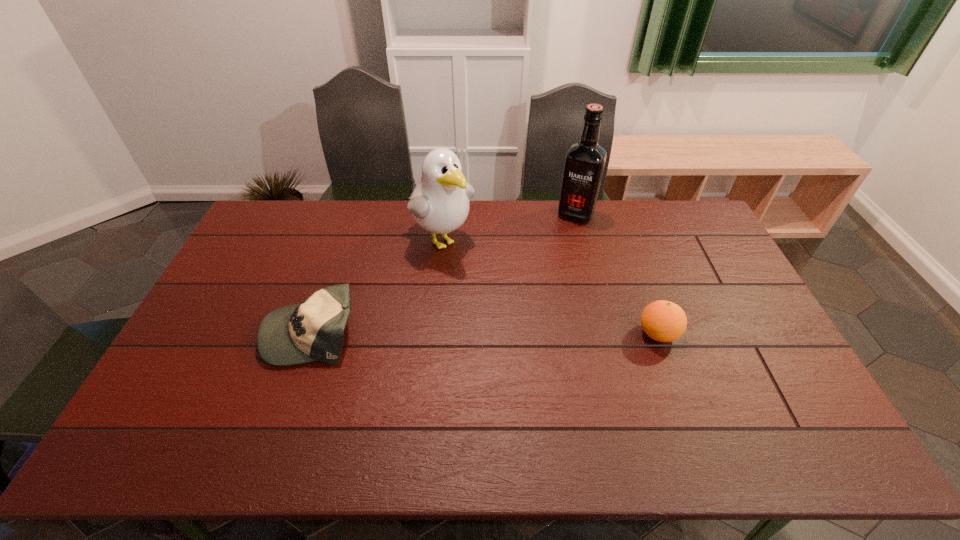
Locate an element on the screen. vacant space at the right edge is located at coordinates (740, 300).

The height and width of the screenshot is (540, 960). In the image, there is a desktop. Find the location of `vacant space at the far left corner`. vacant space at the far left corner is located at coordinates (265, 207).

Identify the location of free space between the liquor and the baseball cap. The image size is (960, 540). (444, 273).

At what (x,y) coordinates should I click in order to perform the action: click on unoccupied area between the third object from right to left and the liquor. Please return your answer as a coordinate pair (x, y). The height and width of the screenshot is (540, 960). Looking at the image, I should click on (509, 226).

The width and height of the screenshot is (960, 540). What are the coordinates of `free space between the orange and the leftmost object` in the screenshot? It's located at (485, 333).

I want to click on free space between the rightmost object and the second object from left to right, so click(x=549, y=286).

Where is `free space between the liquor and the orange`? The width and height of the screenshot is (960, 540). free space between the liquor and the orange is located at coordinates 616,274.

The image size is (960, 540). Identify the location of vacant space in between the third object from left to right and the leftmost object. (444, 273).

At what (x,y) coordinates should I click in order to perform the action: click on free spot between the rightmost object and the baseball cap. Please return your answer as a coordinate pair (x, y). The height and width of the screenshot is (540, 960). Looking at the image, I should click on (485, 333).

Where is `vacant area that lies between the second object from left to right and the baseball cap`? vacant area that lies between the second object from left to right and the baseball cap is located at coordinates (376, 285).